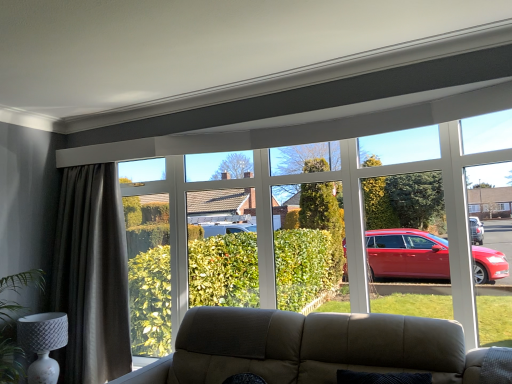
Question: Is dark grey textured curtain at left bigger or smaller than transparent glass bay window at upper center?

Choices:
 (A) small
 (B) big

Answer: (A)

Question: Does point (74, 233) appear closer or farther from the camera than point (440, 187)?

Choices:
 (A) farther
 (B) closer

Answer: (A)

Question: Estimate the real-world distances between objects in this image. Which object is farther from the white textured lamp at lower left?

Choices:
 (A) dark grey textured curtain at left
 (B) transparent glass bay window at upper center

Answer: (B)

Question: Estimate the real-world distances between objects in this image. Which object is farther from the white textured lamp at lower left?

Choices:
 (A) transparent glass bay window at upper center
 (B) dark grey textured curtain at left

Answer: (A)